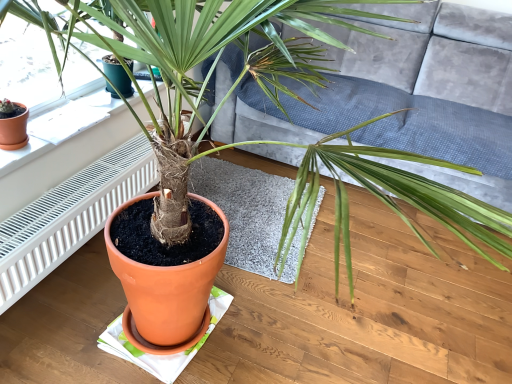
Question: Considering the relative sizes of white textured radiator at left and velvet grey couch at center in the image provided, is white textured radiator at left bigger than velvet grey couch at center?

Choices:
 (A) yes
 (B) no

Answer: (B)

Question: Does white textured radiator at left have a lesser height compared to velvet grey couch at center?

Choices:
 (A) yes
 (B) no

Answer: (A)

Question: Does white textured radiator at left have a smaller size compared to velvet grey couch at center?

Choices:
 (A) yes
 (B) no

Answer: (A)

Question: Would you say white textured radiator at left is outside velvet grey couch at center?

Choices:
 (A) no
 (B) yes

Answer: (B)

Question: Is white textured radiator at left facing towards velvet grey couch at center?

Choices:
 (A) yes
 (B) no

Answer: (B)

Question: Is white textured radiator at left positioned with its back to velvet grey couch at center?

Choices:
 (A) yes
 (B) no

Answer: (B)

Question: Considering the relative sizes of velvet grey couch at center and white paper at upper left in the image provided, is velvet grey couch at center smaller than white paper at upper left?

Choices:
 (A) no
 (B) yes

Answer: (A)

Question: Does velvet grey couch at center lie in front of white paper at upper left?

Choices:
 (A) yes
 (B) no

Answer: (B)

Question: Could you tell me if velvet grey couch at center is turned towards white paper at upper left?

Choices:
 (A) yes
 (B) no

Answer: (A)

Question: Is velvet grey couch at center turned away from white paper at upper left?

Choices:
 (A) no
 (B) yes

Answer: (A)

Question: Does velvet grey couch at center touch white paper at upper left?

Choices:
 (A) no
 (B) yes

Answer: (A)

Question: Considering the relative sizes of velvet grey couch at center and white paper at upper left in the image provided, is velvet grey couch at center thinner than white paper at upper left?

Choices:
 (A) no
 (B) yes

Answer: (A)

Question: From the image's perspective, is white paper at upper left above white textured radiator at left?

Choices:
 (A) no
 (B) yes

Answer: (B)